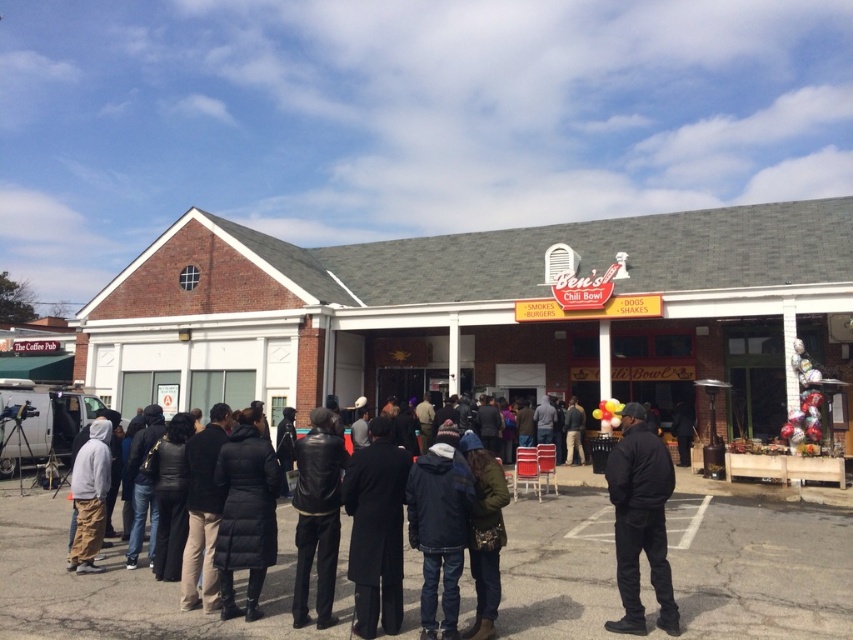
Question: Does denim jacket at center appear on the left side of gray hoodie at left?

Choices:
 (A) no
 (B) yes

Answer: (A)

Question: Does gray hoodie at left appear on the left side of dark gray jacket at center?

Choices:
 (A) yes
 (B) no

Answer: (A)

Question: Among these objects, which one is nearest to the camera?

Choices:
 (A) white brick building at center
 (B) black leather jacket at center
 (C) denim jacket at center

Answer: (C)

Question: Is green fabric jacket at center above dark gray jacket at center?

Choices:
 (A) yes
 (B) no

Answer: (A)

Question: Among these objects, which one is farthest from the camera?

Choices:
 (A) green fabric jacket at center
 (B) dark gray jacket at center
 (C) denim jacket at center

Answer: (B)

Question: Which object appears closest to the camera in this image?

Choices:
 (A) black down jacket at center
 (B) dark gray jacket at center

Answer: (A)